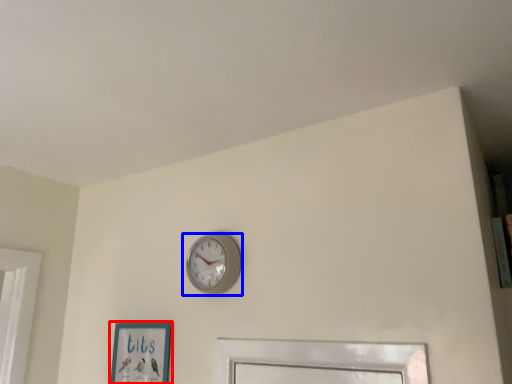
Question: Which object appears closest to the camera in this image, picture frame (highlighted by a red box) or wall clock (highlighted by a blue box)?

Choices:
 (A) picture frame
 (B) wall clock

Answer: (B)